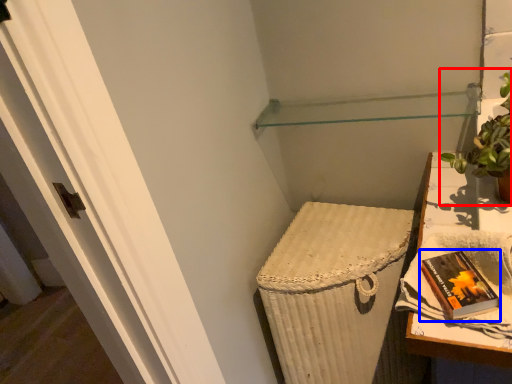
Question: Which of the following is the closest to the observer, houseplant (highlighted by a red box) or paperback book (highlighted by a blue box)?

Choices:
 (A) houseplant
 (B) paperback book

Answer: (B)